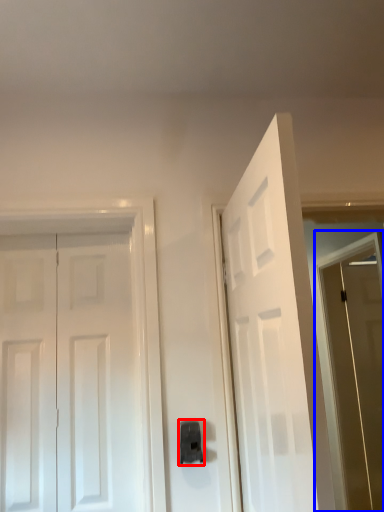
Question: Which of the following is the farthest to the observer, door handle (highlighted by a red box) or screen door (highlighted by a blue box)?

Choices:
 (A) door handle
 (B) screen door

Answer: (B)